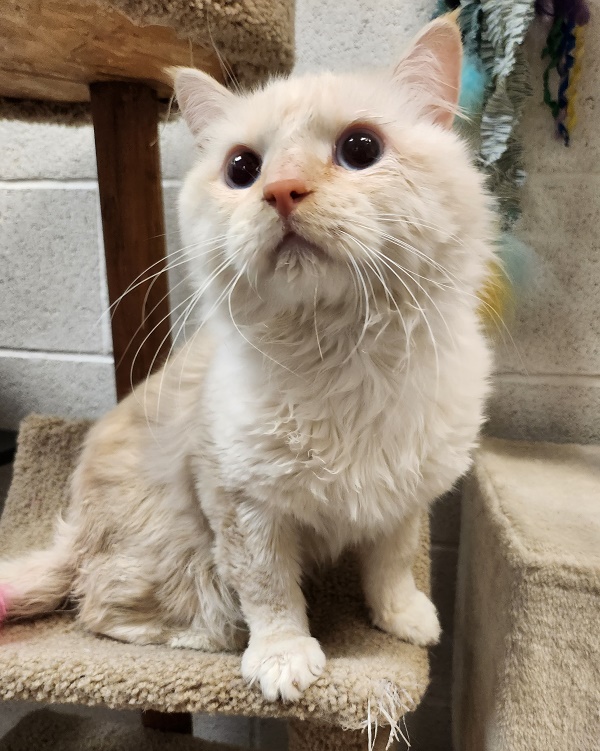
Identify the location of cat tree. This screenshot has width=600, height=751. (557, 611), (375, 665), (116, 742), (134, 7).